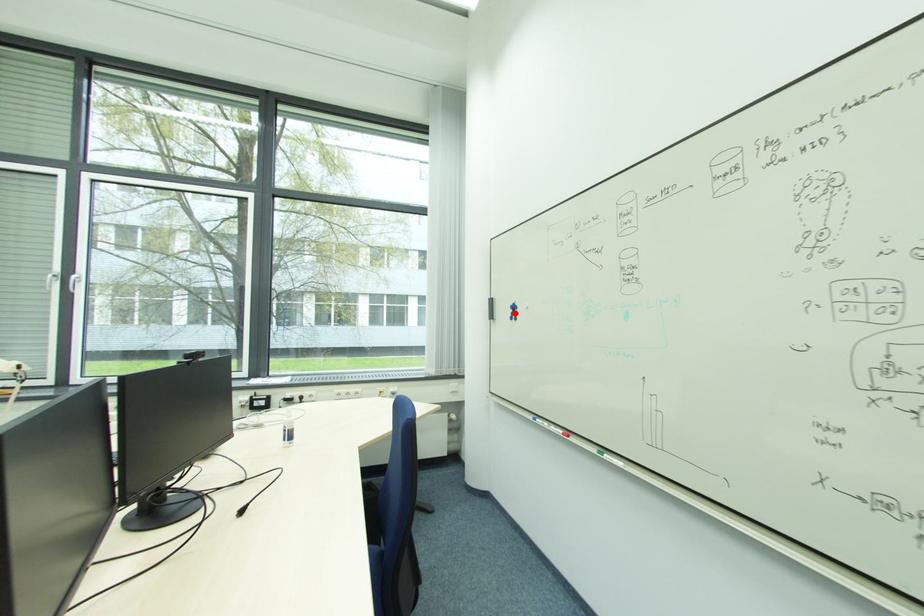
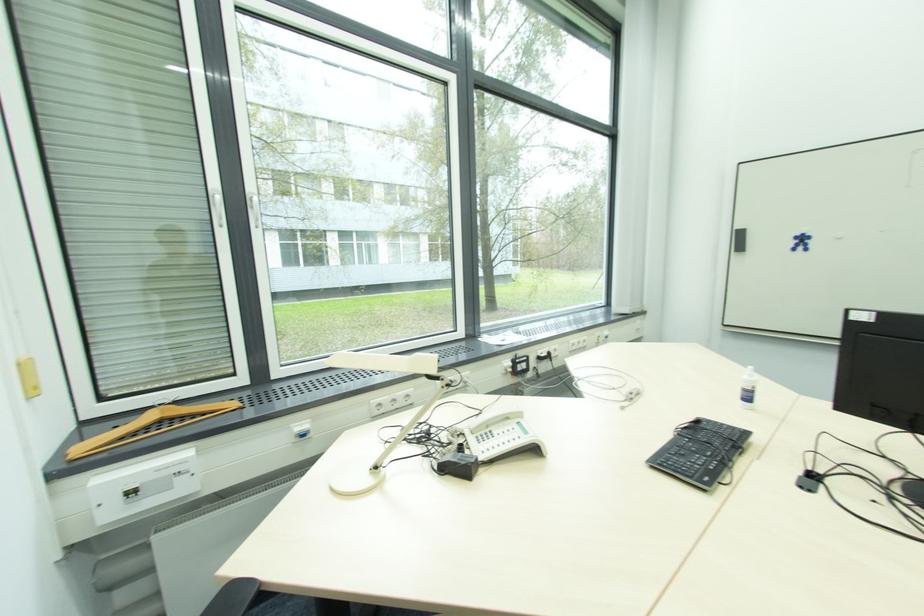
Locate, in the second image, the point that corresponds to the highlighted location in the first image.

(801, 244)